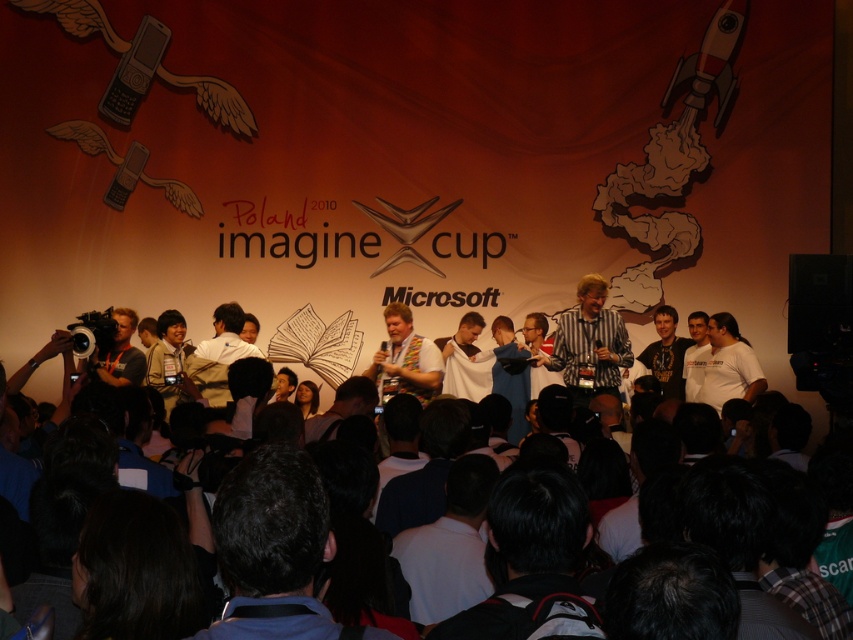
You are a photographer standing at the back of the venue. You want to take a photo of both the striped shirt at center and the light brown shirt at center in the same frame. Given that your camera has a maximum zoom range of 50 meters, can you capture both shirts in one shot?

The distance between the striped shirt at center and the light brown shirt at center is 25.20 meters. Since your camera can zoom up to 50 meters, it can easily capture both shirts within the same frame as the distance between them is well within the camera range.

You are a photographer at the Microsoft Imagine Cup event in Poland 2010. You need to capture a photo where the striped shirt at center and the light brown shirt at center are both visible. Based on their heights, which shirt should you focus on to ensure both are in frame?

The striped shirt at center is taller than the light brown shirt at center, so focusing on the striped shirt at center will ensure both shirts are in frame as it occupies a higher position.